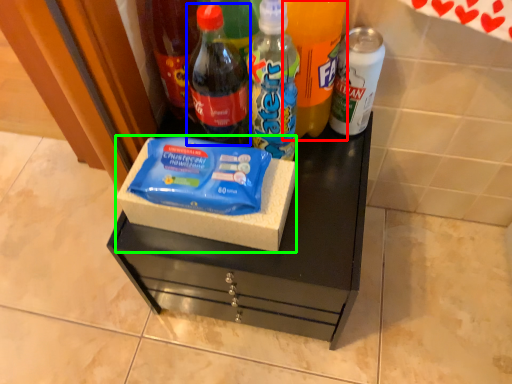
Question: Considering the real-world distances, which object is closest to bottle (highlighted by a red box)? bottle (highlighted by a blue box) or box (highlighted by a green box).

Choices:
 (A) bottle
 (B) box

Answer: (A)